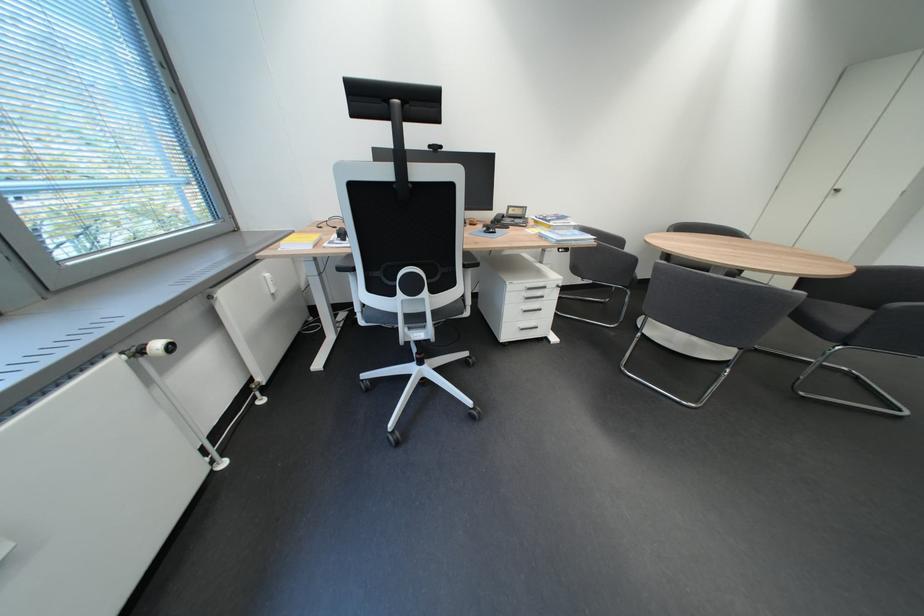
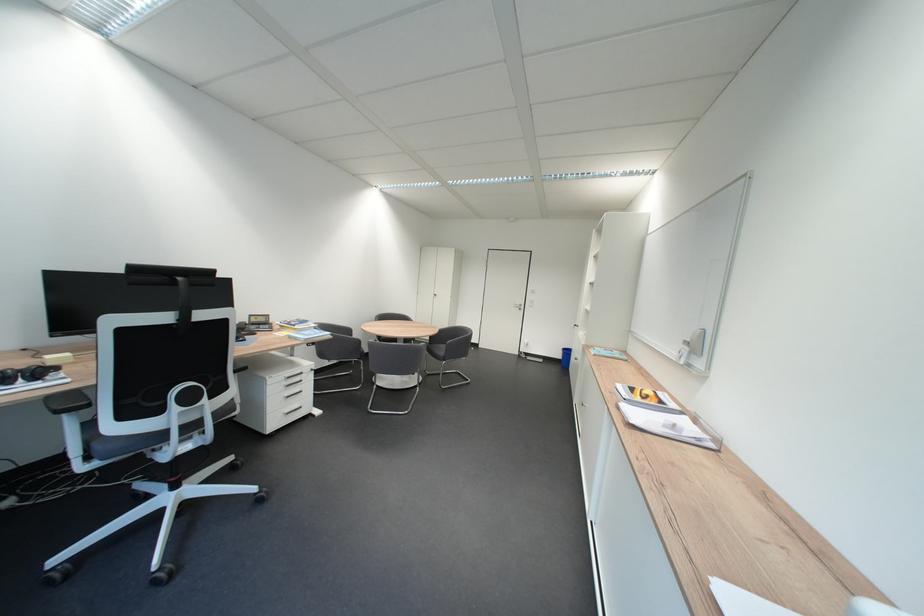
In the second image, find the point that corresponds to the point at 645,262 in the first image.

(371, 342)